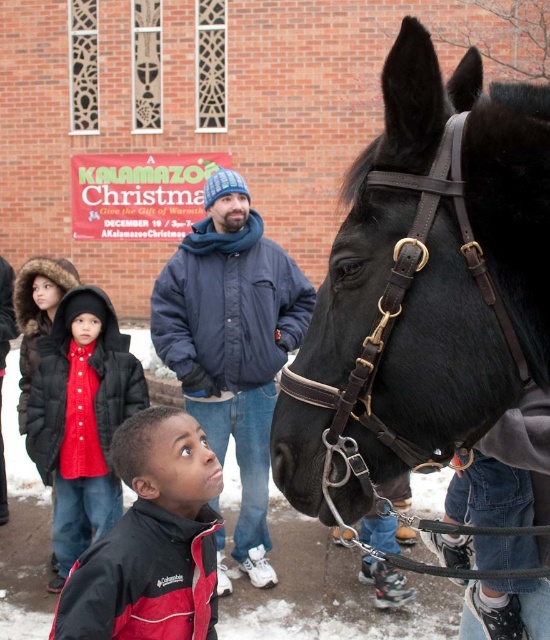
Question: Can you confirm if dark blue jacket at center is bigger than red jacket at lower left?

Choices:
 (A) yes
 (B) no

Answer: (A)

Question: Does black leather horse at center appear on the left side of red jacket at lower left?

Choices:
 (A) yes
 (B) no

Answer: (B)

Question: Estimate the real-world distances between objects in this image. Which object is farther from the dark blue jacket at center?

Choices:
 (A) black leather horse at center
 (B) red quilted coat at lower left

Answer: (A)

Question: Which of these objects is positioned closest to the dark blue jacket at center?

Choices:
 (A) red quilted coat at lower left
 (B) red jacket at lower left
 (C) black leather horse at center

Answer: (A)

Question: Which point is farther to the camera?

Choices:
 (A) black leather horse at center
 (B) red jacket at lower left
 (C) red quilted coat at lower left

Answer: (C)

Question: Is dark blue jacket at center bigger than red jacket at lower left?

Choices:
 (A) yes
 (B) no

Answer: (A)